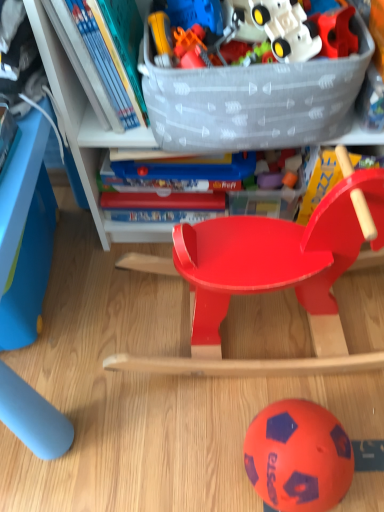
Question: Is glossy plastic rocking horse at center shorter than translucent plastic storage box at upper center?

Choices:
 (A) yes
 (B) no

Answer: (B)

Question: From a real-world perspective, does glossy plastic rocking horse at center stand above translucent plastic storage box at upper center?

Choices:
 (A) yes
 (B) no

Answer: (B)

Question: Can translucent plastic storage box at upper center be found inside glossy plastic rocking horse at center?

Choices:
 (A) no
 (B) yes

Answer: (A)

Question: Is glossy plastic rocking horse at center facing towards translucent plastic storage box at upper center?

Choices:
 (A) yes
 (B) no

Answer: (B)

Question: Is glossy plastic rocking horse at center further to camera compared to translucent plastic storage box at upper center?

Choices:
 (A) no
 (B) yes

Answer: (A)

Question: Does glossy plastic rocking horse at center appear on the right side of translucent plastic storage box at upper center?

Choices:
 (A) no
 (B) yes

Answer: (B)

Question: Is glossy plastic rocking horse at center further to the viewer compared to orange rubber ball at lower center?

Choices:
 (A) no
 (B) yes

Answer: (A)

Question: Does glossy plastic rocking horse at center appear on the right side of orange rubber ball at lower center?

Choices:
 (A) yes
 (B) no

Answer: (B)

Question: From a real-world perspective, is glossy plastic rocking horse at center on top of orange rubber ball at lower center?

Choices:
 (A) yes
 (B) no

Answer: (A)

Question: Could orange rubber ball at lower center be considered to be inside glossy plastic rocking horse at center?

Choices:
 (A) yes
 (B) no

Answer: (B)

Question: Is glossy plastic rocking horse at center shorter than orange rubber ball at lower center?

Choices:
 (A) yes
 (B) no

Answer: (B)

Question: Is the surface of glossy plastic rocking horse at center in direct contact with orange rubber ball at lower center?

Choices:
 (A) no
 (B) yes

Answer: (A)

Question: Can you confirm if translucent plastic storage box at upper center is taller than glossy plastic rocking horse at center?

Choices:
 (A) yes
 (B) no

Answer: (B)